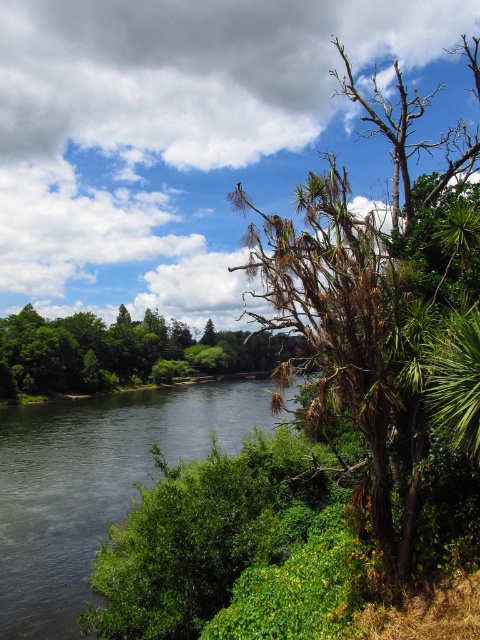
Question: Which is farther from the dark green water at center?

Choices:
 (A) brown/dried wood tree at right
 (B) brown leafy tree at center

Answer: (A)

Question: Which object is positioned closest to the brown leafy tree at center?

Choices:
 (A) dark green water at center
 (B) brown/dried wood tree at right

Answer: (A)

Question: Which point is farther to the camera?

Choices:
 (A) brown/dried wood tree at right
 (B) dark green water at center

Answer: (B)

Question: Does brown/dried wood tree at right appear under brown leafy tree at center?

Choices:
 (A) yes
 (B) no

Answer: (B)

Question: Is brown/dried wood tree at right positioned behind brown leafy tree at center?

Choices:
 (A) yes
 (B) no

Answer: (B)

Question: Is brown/dried wood tree at right above dark green water at center?

Choices:
 (A) no
 (B) yes

Answer: (B)